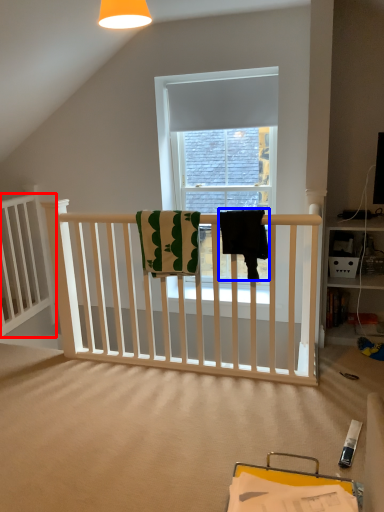
Question: Among these objects, which one is nearest to the camera, bed frame (highlighted by a red box) or beach towel (highlighted by a blue box)?

Choices:
 (A) bed frame
 (B) beach towel

Answer: (B)